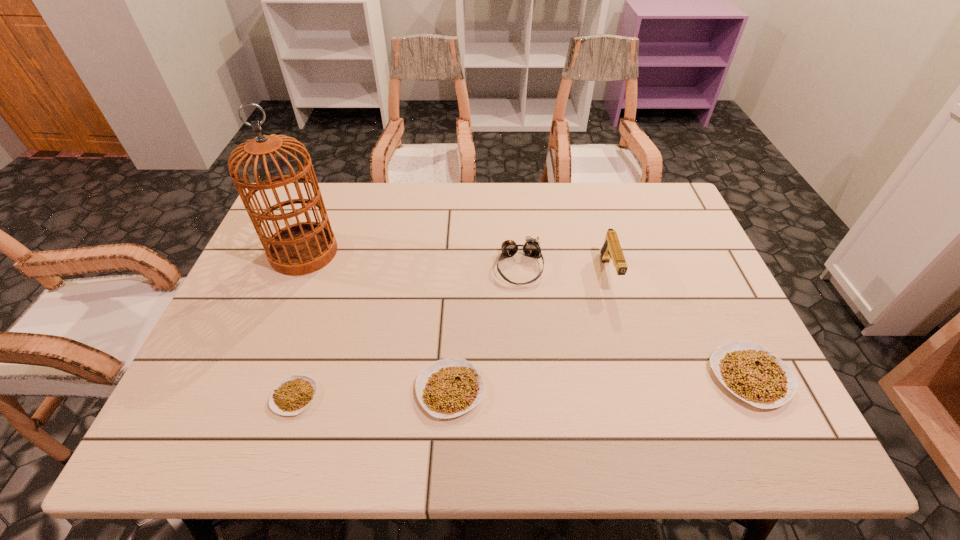
Find the location of `free space located 0.090m on the left of the shortest object`. free space located 0.090m on the left of the shortest object is located at coordinates (231, 397).

Where is `free space located 0.060m on the right of the second legume from left to right`? The width and height of the screenshot is (960, 540). free space located 0.060m on the right of the second legume from left to right is located at coordinates (512, 390).

Image resolution: width=960 pixels, height=540 pixels. What are the coordinates of `blank area located 0.090m on the back of the rightmost legume` in the screenshot? It's located at (720, 315).

This screenshot has width=960, height=540. Find the location of `vacant space located 0.170m on the front of the birdcage`. vacant space located 0.170m on the front of the birdcage is located at coordinates (275, 325).

The height and width of the screenshot is (540, 960). In order to click on free space located at the barrel of the second object from right to left in this screenshot , I will do `click(632, 353)`.

Locate an element on the screen. vacant region located through the lenses of the fourth object from left to right is located at coordinates (531, 392).

The image size is (960, 540). Identify the location of object located in the left edge section of the desktop. (301, 248).

Locate an element on the screen. This screenshot has width=960, height=540. object at the right edge is located at coordinates (751, 372).

In order to click on object that is at the near right corner in this screenshot , I will do `click(751, 372)`.

The width and height of the screenshot is (960, 540). In the image, there is a desktop. What are the coordinates of `vacant space at the far edge` in the screenshot? It's located at (612, 183).